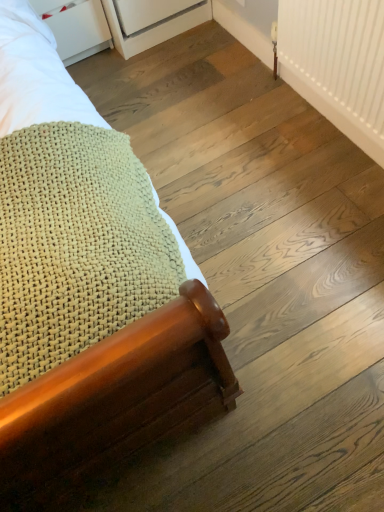
Where is `free space behind white plastic radiator at upper right`? free space behind white plastic radiator at upper right is located at coordinates (239, 78).